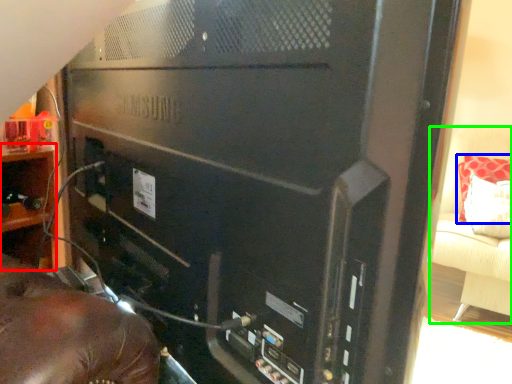
Question: Considering the real-world distances, which object is farthest from shelf (highlighted by a red box)? pillow (highlighted by a blue box) or furniture (highlighted by a green box)?

Choices:
 (A) pillow
 (B) furniture

Answer: (A)